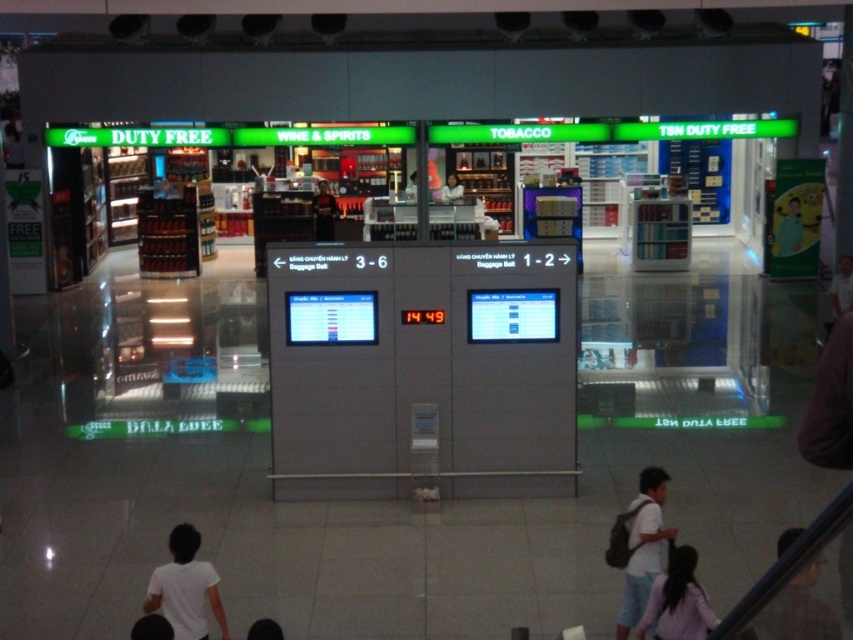
Question: Is dark brown hair at lower right below smooth white shirt at center?

Choices:
 (A) no
 (B) yes

Answer: (B)

Question: Which of these objects is positioned farthest from the light pink fabric at lower right?

Choices:
 (A) smooth white shirt at center
 (B) white matte shirt at lower left
 (C) white cotton shirt at lower right

Answer: (A)

Question: Is white matte shirt at lower left below smooth white shirt at center?

Choices:
 (A) no
 (B) yes

Answer: (B)

Question: Which object is positioned farthest from the white cotton shirt at lower right?

Choices:
 (A) light pink fabric at lower right
 (B) dark brown hair at lower right
 (C) smooth white shirt at center

Answer: (C)

Question: Which point appears farthest from the camera in this image?

Choices:
 (A) (454, 198)
 (B) (679, 609)

Answer: (A)

Question: Is dark brown hair at lower right below smooth white shirt at center?

Choices:
 (A) yes
 (B) no

Answer: (A)